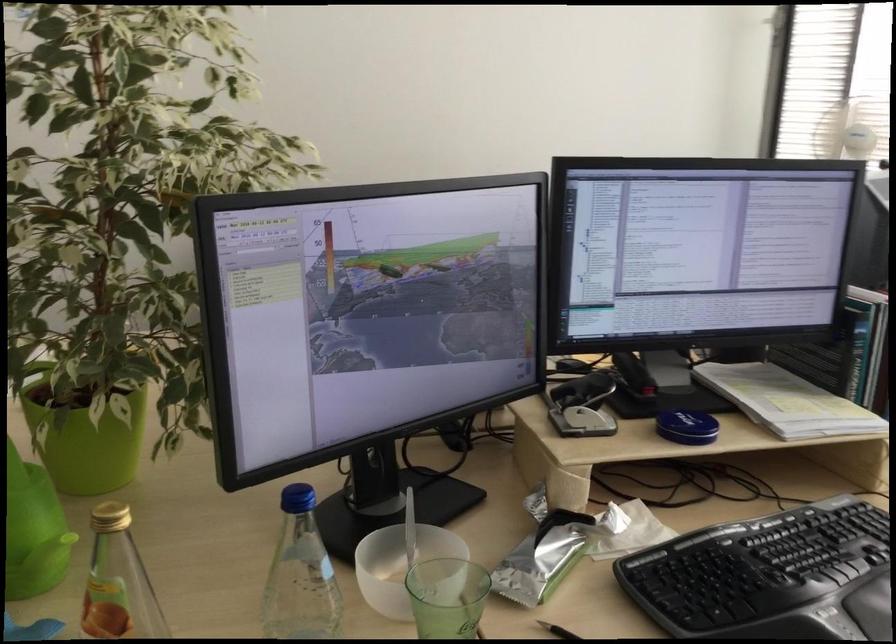
What do you see at coordinates (109, 516) in the screenshot?
I see `the gold bottle cap` at bounding box center [109, 516].